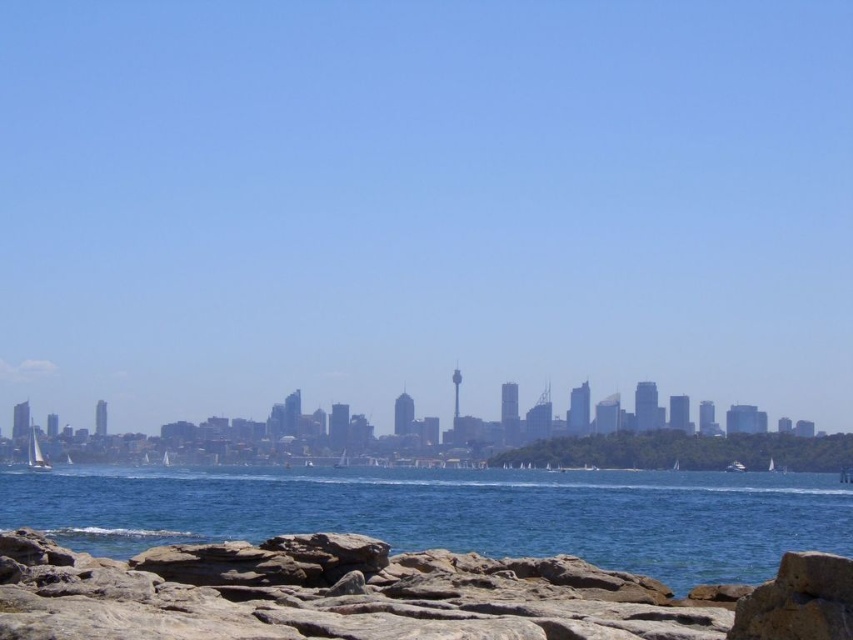
The image size is (853, 640). Find the location of `blue water at lower center`. blue water at lower center is located at coordinates (453, 513).

Which is more to the right, blue water at lower center or white sailboat at lower left?

blue water at lower center is more to the right.

Image resolution: width=853 pixels, height=640 pixels. Describe the element at coordinates (453, 513) in the screenshot. I see `blue water at lower center` at that location.

This screenshot has height=640, width=853. I want to click on blue water at lower center, so click(x=453, y=513).

Which is above, rusty stone rocks at lower left or blue water at lower center?

rusty stone rocks at lower left is higher up.

Find the location of a particular element. rusty stone rocks at lower left is located at coordinates (392, 595).

I want to click on rusty stone rocks at lower left, so click(x=392, y=595).

You are a GUI agent. You are given a task and a screenshot of the screen. Output one action in this format:
    pyautogui.click(x=<x>, y=<y>)
    Task: Click on the rusty stone rocks at lower left
    The width and height of the screenshot is (853, 640).
    Given the screenshot: What is the action you would take?
    pyautogui.click(x=392, y=595)

Who is more distant from viewer, (260, 637) or (33, 445)?

Positioned behind is point (33, 445).

Find the location of a particular element. This screenshot has height=640, width=853. rusty stone rocks at lower left is located at coordinates (392, 595).